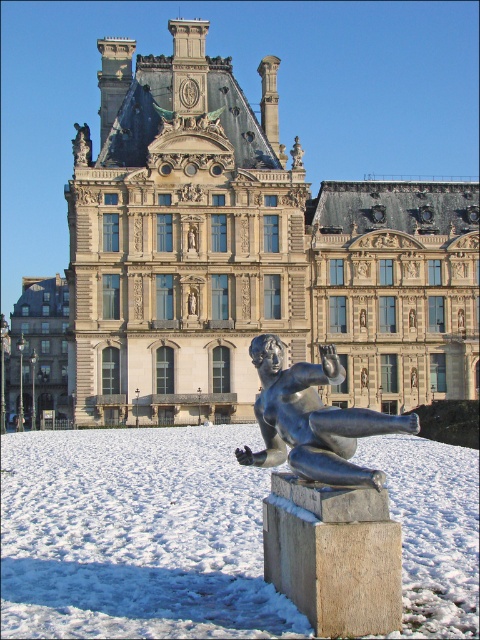
You are standing in front of the grand building and notice both the white snow at center and the polished bronze statue at center. Which object is nearer to you?

The white snow at center is closer to the viewer than the polished bronze statue at center.